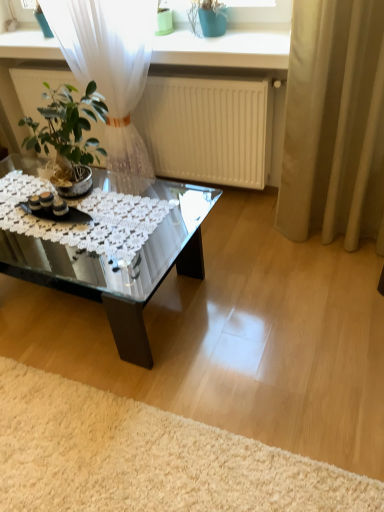
Question: Is beige fabric curtain at right smaller than transparent glass coffee table at center?

Choices:
 (A) no
 (B) yes

Answer: (B)

Question: From a real-world perspective, is beige fabric curtain at right located higher than transparent glass coffee table at center?

Choices:
 (A) yes
 (B) no

Answer: (A)

Question: Does beige fabric curtain at right have a lesser width compared to transparent glass coffee table at center?

Choices:
 (A) no
 (B) yes

Answer: (B)

Question: Does beige fabric curtain at right turn towards transparent glass coffee table at center?

Choices:
 (A) no
 (B) yes

Answer: (A)

Question: From the image's perspective, is beige fabric curtain at right under transparent glass coffee table at center?

Choices:
 (A) yes
 (B) no

Answer: (B)

Question: Considering the relative positions of beige fabric curtain at right and transparent glass coffee table at center in the image provided, is beige fabric curtain at right to the left of transparent glass coffee table at center from the viewer's perspective?

Choices:
 (A) no
 (B) yes

Answer: (A)

Question: Is white matte radiator at upper center positioned with its back to transparent glass coffee table at center?

Choices:
 (A) no
 (B) yes

Answer: (A)

Question: Would you consider white matte radiator at upper center to be distant from transparent glass coffee table at center?

Choices:
 (A) no
 (B) yes

Answer: (A)

Question: Could you tell me if white matte radiator at upper center is facing transparent glass coffee table at center?

Choices:
 (A) no
 (B) yes

Answer: (B)

Question: From a real-world perspective, is white matte radiator at upper center under transparent glass coffee table at center?

Choices:
 (A) no
 (B) yes

Answer: (A)

Question: Is white matte radiator at upper center directly adjacent to transparent glass coffee table at center?

Choices:
 (A) yes
 (B) no

Answer: (B)

Question: Considering the relative sizes of white matte radiator at upper center and transparent glass coffee table at center in the image provided, is white matte radiator at upper center thinner than transparent glass coffee table at center?

Choices:
 (A) no
 (B) yes

Answer: (B)

Question: Is transparent glass coffee table at center next to beige fabric curtain at right?

Choices:
 (A) yes
 (B) no

Answer: (B)